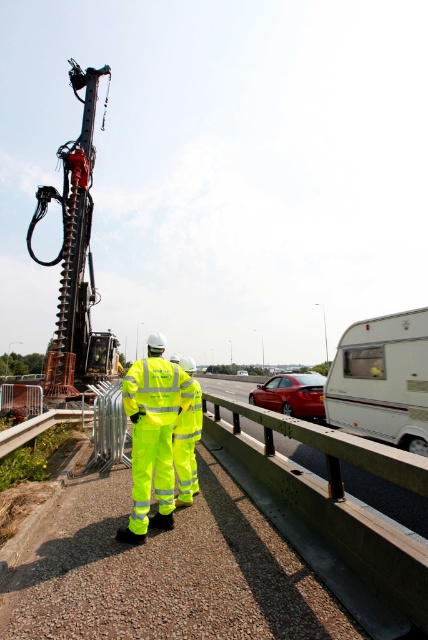
You are a delivery driver who needs to pass through this construction zone. You see a white matte trailer truck at right and a neon yellow reflective suit at center. Which object is larger in size?

The white matte trailer truck at right is bigger than the neon yellow reflective suit at center according to the description.

Looking at this image, you are a delivery driver approaching the construction zone and need to pass under the white matte trailer truck at right and the neon yellow reflective suit at center. Which object do you need to be cautious about the height limit for?

The white matte trailer truck at right is much taller than the neon yellow reflective suit at center, so you need to be cautious about the height limit for the white matte trailer truck at right.

You are a driver approaching the construction zone and see the neon yellow reflective suit at center and the glossy red car at center. Which object is taller from your perspective?

The neon yellow reflective suit at center is much taller than the glossy red car at center.